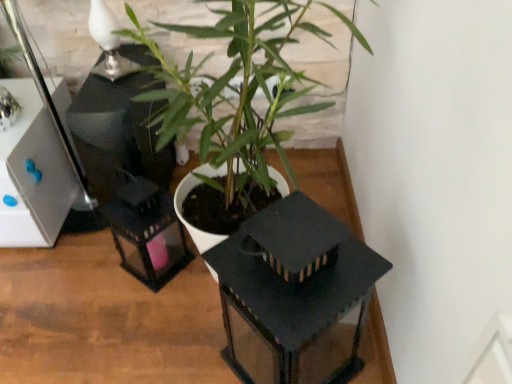
In order to click on vacant space that is to the left of green matte plant at center in this screenshot , I will do `click(74, 301)`.